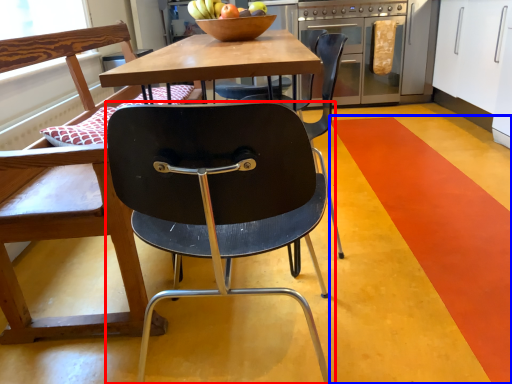
Question: Which point is closer to the camera, chair (highlighted by a red box) or stripe (highlighted by a blue box)?

Choices:
 (A) chair
 (B) stripe

Answer: (A)